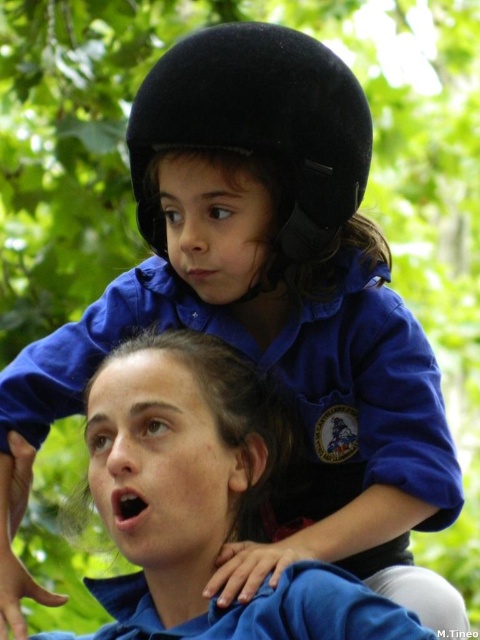
Question: From the image, what is the correct spatial relationship of blue fabric shirt at upper center in relation to black felt helmet at upper center?

Choices:
 (A) above
 (B) below

Answer: (B)

Question: Is blue fabric shirt at upper center wider than black felt helmet at upper center?

Choices:
 (A) no
 (B) yes

Answer: (B)

Question: Which of the following is the closest to the observer?

Choices:
 (A) blue fabric shirt at upper center
 (B) black felt helmet at upper center

Answer: (A)

Question: Does blue fabric shirt at upper center have a smaller size compared to black felt helmet at upper center?

Choices:
 (A) no
 (B) yes

Answer: (A)

Question: Which point appears closest to the camera in this image?

Choices:
 (A) 171,417
 (B) 141,205

Answer: (A)